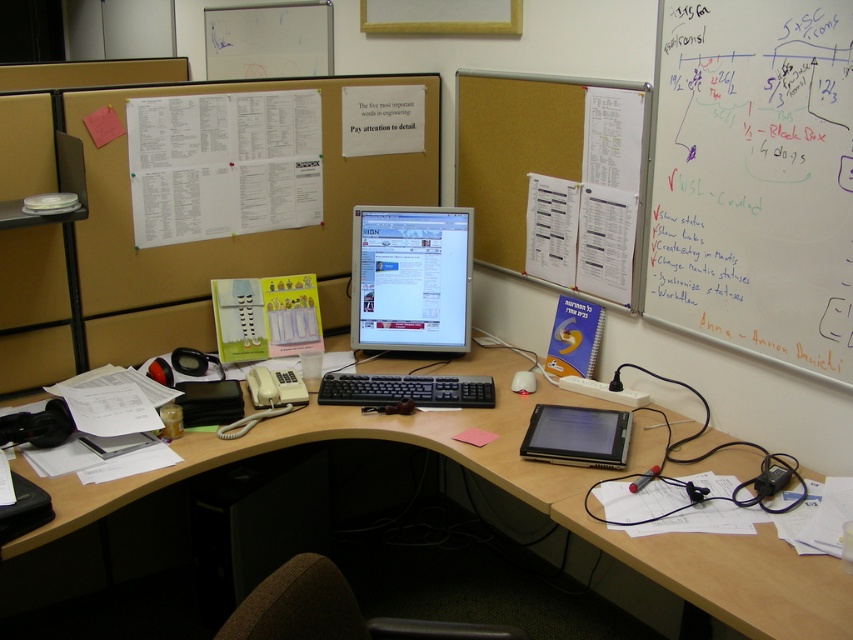
Does point (419, 227) come in front of point (613, 444)?

No, (419, 227) is further to viewer.

Is matte black monitor at center thinner than black glossy tablet at center?

In fact, matte black monitor at center might be wider than black glossy tablet at center.

The width and height of the screenshot is (853, 640). I want to click on matte black monitor at center, so click(410, 278).

This screenshot has height=640, width=853. In order to click on matte black monitor at center in this screenshot , I will do `click(410, 278)`.

In the scene shown: Measure the distance between whiteboard at upper right and corkboard at upper right.

They are 13.60 inches apart.

Find the location of `whiteboard at upper right`. whiteboard at upper right is located at coordinates (753, 179).

What do you see at coordinates (753, 179) in the screenshot? I see `whiteboard at upper right` at bounding box center [753, 179].

You are a GUI agent. You are given a task and a screenshot of the screen. Output one action in this format:
    pyautogui.click(x=<x>, y=<y>)
    Task: Click on the whiteboard at upper right
    This screenshot has height=640, width=853.
    Given the screenshot: What is the action you would take?
    pyautogui.click(x=753, y=179)

Is corkboard at upper right positioned before black plastic keyboard at center?

That is True.

Can you confirm if corkboard at upper right is positioned to the right of black plastic keyboard at center?

Yes, corkboard at upper right is to the right of black plastic keyboard at center.

Find the location of a particular element. This screenshot has height=640, width=853. corkboard at upper right is located at coordinates (556, 179).